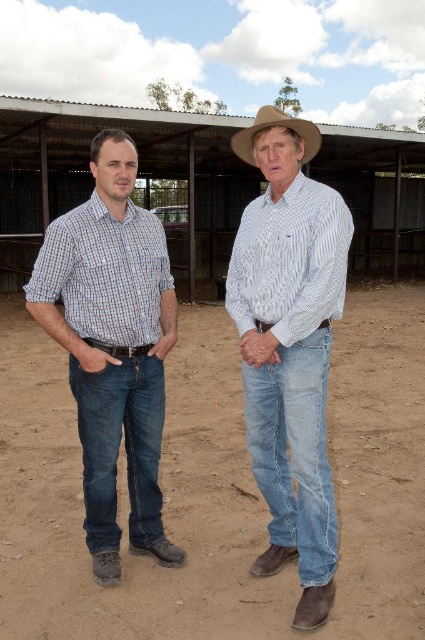
Is point (150, 232) positioned behind point (130, 241)?

Yes, point (150, 232) is farther from viewer.

Who is positioned more to the right, matte plaid shirt at left or checkered fabric shirt at left?

Positioned to the right is checkered fabric shirt at left.

Find the location of a particular element. matte plaid shirt at left is located at coordinates (113, 348).

Does matte plaid shirt at left appear on the right side of light blue denim jeans at center?

Incorrect, matte plaid shirt at left is not on the right side of light blue denim jeans at center.

What are the coordinates of `matte plaid shirt at left` in the screenshot? It's located at (113, 348).

Locate an element on the screen. This screenshot has width=425, height=640. matte plaid shirt at left is located at coordinates (113, 348).

Between point (243, 308) and point (130, 172), which one is positioned in front?

Positioned in front is point (130, 172).

Does white checkered shirt at center appear over matte plaid shirt at left?

Indeed, white checkered shirt at center is positioned over matte plaid shirt at left.

Who is more forward, (345,282) or (121,348)?

Point (121,348)

You are a GUI agent. You are given a task and a screenshot of the screen. Output one action in this format:
    pyautogui.click(x=<x>, y=<y>)
    Task: Click on the white checkered shirt at center
    This screenshot has height=640, width=425.
    Given the screenshot: What is the action you would take?
    pyautogui.click(x=289, y=346)